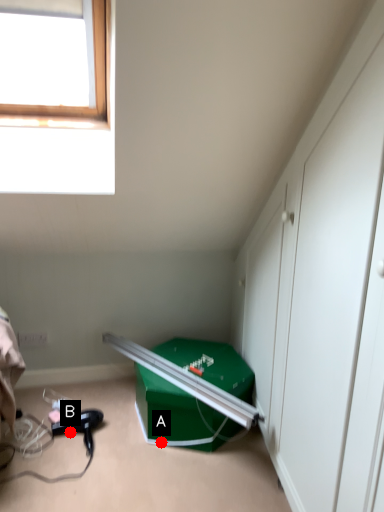
Question: Two points are circled on the image, labeled by A and B beside each circle. Which point appears farthest from the camera in this image?

Choices:
 (A) A is further
 (B) B is further

Answer: (B)